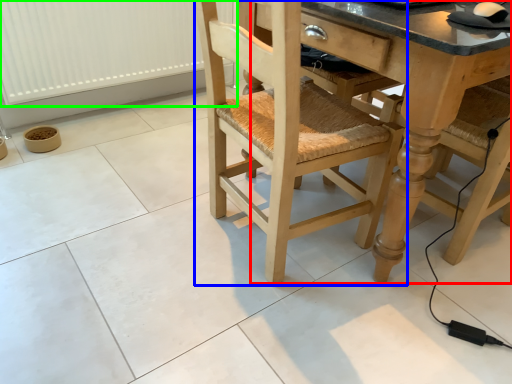
Question: Considering the real-world distances, which object is farthest from counter top (highlighted by a red box)? chair (highlighted by a blue box) or radiator (highlighted by a green box)?

Choices:
 (A) chair
 (B) radiator

Answer: (B)